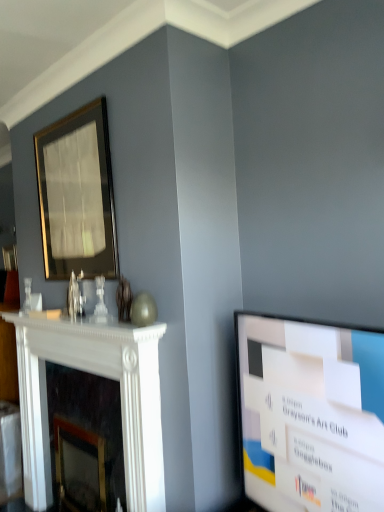
Question: Is the depth of white marble fireplace at left greater than that of gold-framed mirror at upper left?

Choices:
 (A) yes
 (B) no

Answer: (B)

Question: Does white marble fireplace at left appear on the right side of gold-framed mirror at upper left?

Choices:
 (A) no
 (B) yes

Answer: (B)

Question: Considering the relative sizes of white marble fireplace at left and gold-framed mirror at upper left in the image provided, is white marble fireplace at left shorter than gold-framed mirror at upper left?

Choices:
 (A) no
 (B) yes

Answer: (A)

Question: Is white marble fireplace at left positioned in front of gold-framed mirror at upper left?

Choices:
 (A) no
 (B) yes

Answer: (B)

Question: Is white marble fireplace at left bigger than gold-framed mirror at upper left?

Choices:
 (A) no
 (B) yes

Answer: (B)

Question: Would you consider white marble fireplace at left to be distant from gold-framed mirror at upper left?

Choices:
 (A) no
 (B) yes

Answer: (A)

Question: Are white glossy screen at right and gold-framed mirror at upper left making contact?

Choices:
 (A) yes
 (B) no

Answer: (B)

Question: From a real-world perspective, is white glossy screen at right physically above gold-framed mirror at upper left?

Choices:
 (A) yes
 (B) no

Answer: (B)

Question: Is white glossy screen at right bigger than gold-framed mirror at upper left?

Choices:
 (A) no
 (B) yes

Answer: (B)

Question: Would you say white glossy screen at right is outside gold-framed mirror at upper left?

Choices:
 (A) yes
 (B) no

Answer: (A)

Question: Considering the relative positions of white glossy screen at right and gold-framed mirror at upper left in the image provided, is white glossy screen at right to the right of gold-framed mirror at upper left from the viewer's perspective?

Choices:
 (A) yes
 (B) no

Answer: (A)

Question: Does white glossy screen at right lie in front of gold-framed mirror at upper left?

Choices:
 (A) yes
 (B) no

Answer: (A)

Question: Is white marble fireplace at left outside of white glossy screen at right?

Choices:
 (A) yes
 (B) no

Answer: (A)